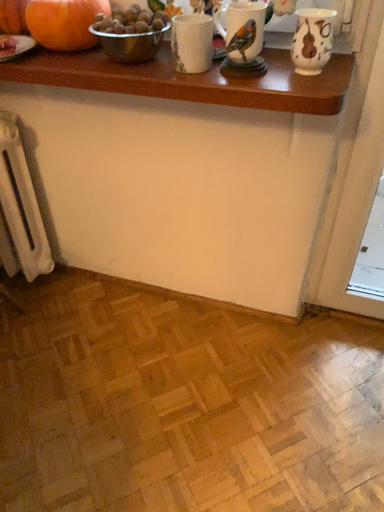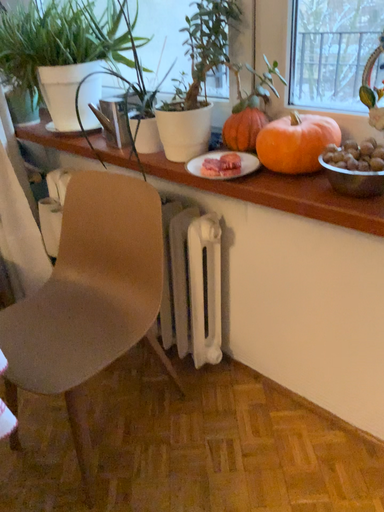
Question: Which way did the camera rotate in the video?

Choices:
 (A) rotated right
 (B) rotated left

Answer: (B)